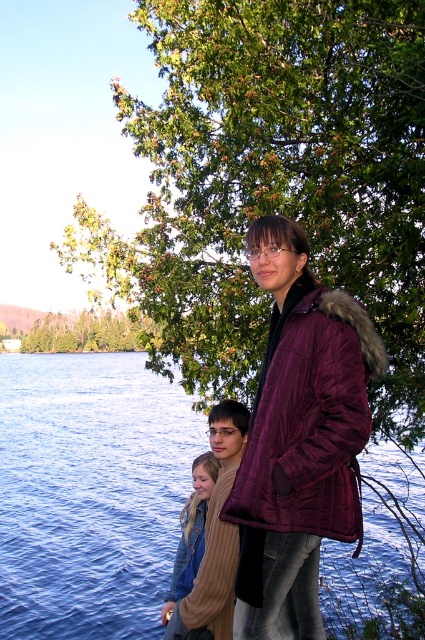
Does point (221, 419) come in front of point (87, 312)?

That is True.

Can you confirm if brown ribbed sweater at lower center is positioned below green leafy tree at upper left?

Indeed, brown ribbed sweater at lower center is positioned under green leafy tree at upper left.

Is point (227, 630) less distant than point (105, 342)?

Yes, it is in front of point (105, 342).

The image size is (425, 640). I want to click on brown ribbed sweater at lower center, so click(x=215, y=536).

Between blue water at lower left and light brown knitted sweater at lower center, which one has less height?

Standing shorter between the two is light brown knitted sweater at lower center.

Who is positioned more to the left, blue water at lower left or light brown knitted sweater at lower center?

From the viewer's perspective, blue water at lower left appears more on the left side.

Find the location of `blue water at lower left`. blue water at lower left is located at coordinates (90, 493).

In order to click on blue water at lower left in this screenshot , I will do click(90, 493).

Does green leafy tree at upper center have a lesser width compared to maroon quilted jacket at center?

In fact, green leafy tree at upper center might be wider than maroon quilted jacket at center.

Which is in front, point (269, 209) or point (357, 378)?

Point (357, 378)

Who is more forward, (277, 122) or (365, 413)?

Point (365, 413)

Locate an element on the screen. The image size is (425, 640). green leafy tree at upper center is located at coordinates (274, 182).